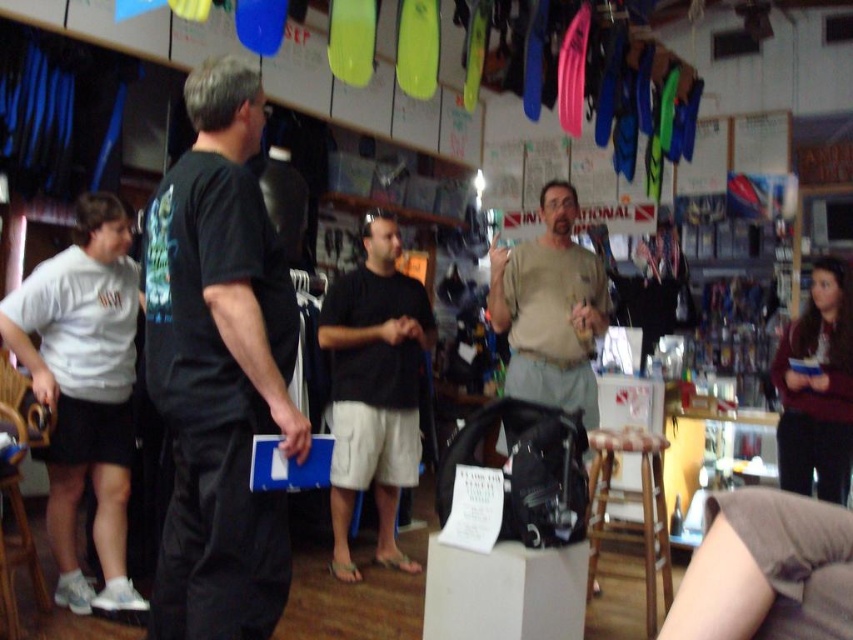
You are organizing a diving equipment display and need to place the black matte shorts at center and the wooden stool at lower right in a limited space. Which object should you choose to place first if you want to prioritize fitting both items into the area?

Since the black matte shorts at center occupies less space than the wooden stool at lower right, you should place the wooden stool at lower right first to ensure both items fit into the limited space.